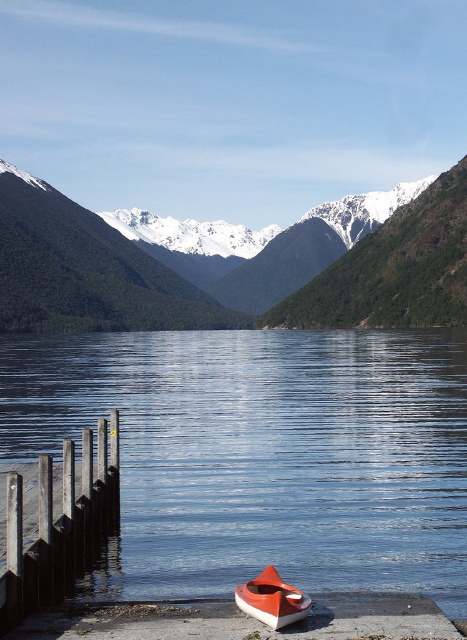
You are standing at point point [261,582] and want to walk to point point [33,244]. Which direction should you face to move towards your destination?

Since point [33,244] is behind point [261,582], you should face away from the direction you are currently facing to move towards point [33,244].